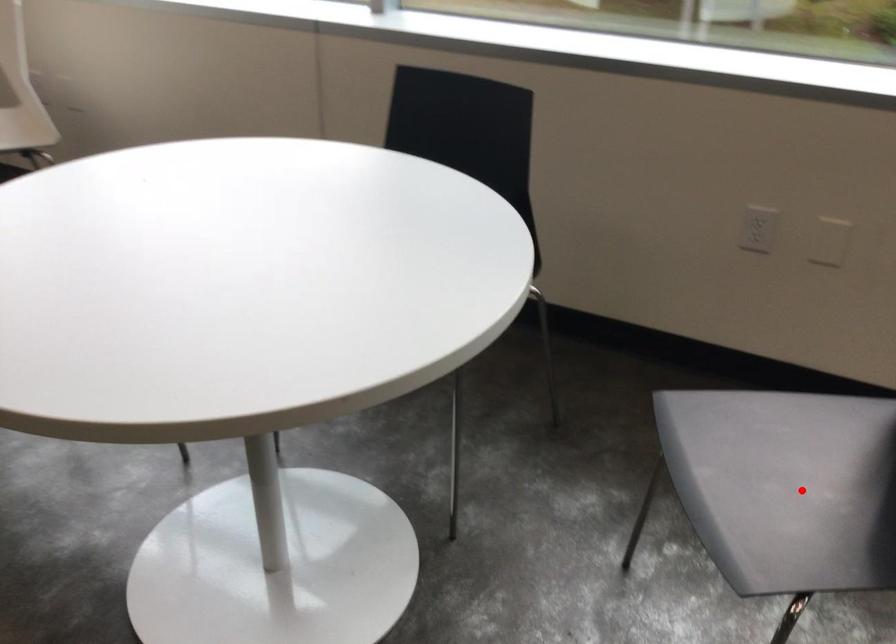
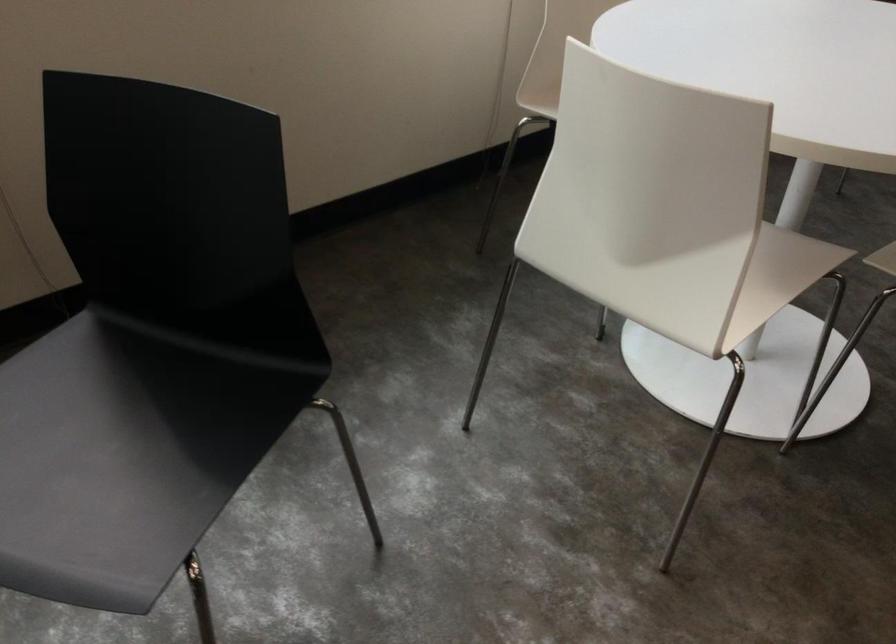
In the second image, find the point that corresponds to the highlighted location in the first image.

(124, 459)